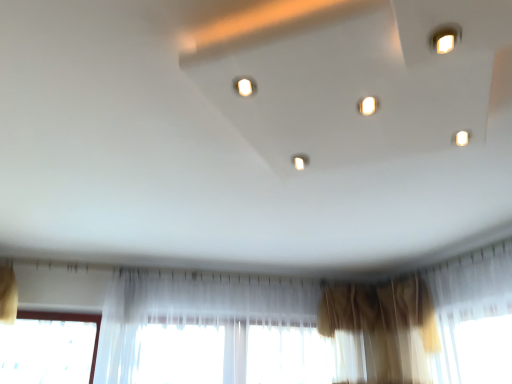
Question: Considering the relative positions of brown sheer curtain at lower right, the first curtain in the right-to-left sequence, and matte white light at center, which is the first light in front-to-back order, in the image provided, is brown sheer curtain at lower right, the first curtain in the right-to-left sequence, to the right of matte white light at center, which is the first light in front-to-back order, from the viewer's perspective?

Choices:
 (A) yes
 (B) no

Answer: (A)

Question: Is matte white light at center, the second light when ordered from back to front, at the back of brown sheer curtain at lower right, the first curtain in the right-to-left sequence?

Choices:
 (A) yes
 (B) no

Answer: (B)

Question: Considering the relative sizes of brown sheer curtain at lower right, the first curtain in the right-to-left sequence, and matte white light at center, the second light from the bottom, in the image provided, is brown sheer curtain at lower right, the first curtain in the right-to-left sequence, wider than matte white light at center, the second light from the bottom,?

Choices:
 (A) yes
 (B) no

Answer: (A)

Question: Can you confirm if brown sheer curtain at lower right, which is the 2th curtain from left to right, is thinner than matte white light at center, the second light when ordered from back to front?

Choices:
 (A) yes
 (B) no

Answer: (B)

Question: Are brown sheer curtain at lower right, which is the 2th curtain from left to right, and matte white light at center, which appears as the second light when viewed from the right, beside each other?

Choices:
 (A) yes
 (B) no

Answer: (B)

Question: Relative to translucent fabric curtain at lower center, which ranks as the 2th curtain in right-to-left order, is white glossy light at center, the 2th light from the front, in front or behind?

Choices:
 (A) behind
 (B) front

Answer: (B)

Question: From the image's perspective, is white glossy light at center, which ranks as the 1th light in right-to-left order, above or below translucent fabric curtain at lower center, which ranks as the 2th curtain in right-to-left order?

Choices:
 (A) above
 (B) below

Answer: (A)

Question: Would you say white glossy light at center, the 2th light from the front, is to the left or to the right of translucent fabric curtain at lower center, which ranks as the 2th curtain in right-to-left order, in the picture?

Choices:
 (A) left
 (B) right

Answer: (B)

Question: Based on their sizes in the image, would you say white glossy light at center, the 2th light from the front, is bigger or smaller than translucent fabric curtain at lower center, placed as the 1th curtain when sorted from left to right?

Choices:
 (A) big
 (B) small

Answer: (B)

Question: Based on their positions, is brown sheer curtain at lower right, which is the 2th curtain from left to right, located to the left or right of white glossy light at center, the first light from the back?

Choices:
 (A) right
 (B) left

Answer: (A)

Question: In terms of height, does brown sheer curtain at lower right, the first curtain in the right-to-left sequence, look taller or shorter compared to white glossy light at center, arranged as the second light when viewed from the top?

Choices:
 (A) tall
 (B) short

Answer: (A)

Question: Based on their sizes in the image, would you say brown sheer curtain at lower right, the first curtain in the right-to-left sequence, is bigger or smaller than white glossy light at center, the first light from the back?

Choices:
 (A) big
 (B) small

Answer: (A)

Question: Do you think brown sheer curtain at lower right, the first curtain in the right-to-left sequence, is within white glossy light at center, which ranks as the 1th light in right-to-left order, or outside of it?

Choices:
 (A) inside
 (B) outside

Answer: (B)

Question: Considering the positions of matte white light at center, positioned as the 1th light in top-to-bottom order, and translucent fabric curtain at lower center, placed as the 1th curtain when sorted from left to right, in the image, is matte white light at center, positioned as the 1th light in top-to-bottom order, bigger or smaller than translucent fabric curtain at lower center, placed as the 1th curtain when sorted from left to right,?

Choices:
 (A) small
 (B) big

Answer: (A)

Question: Would you say matte white light at center, the second light when ordered from back to front, is inside or outside translucent fabric curtain at lower center, placed as the 1th curtain when sorted from left to right?

Choices:
 (A) inside
 (B) outside

Answer: (B)